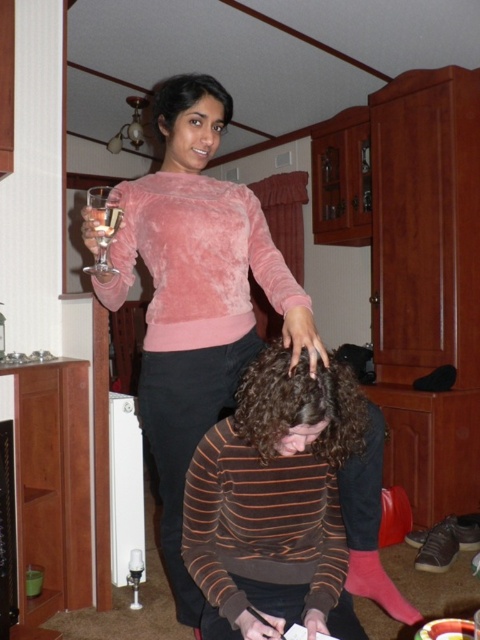
Does velvet pink sweater at upper center appear over clear glass wine glass at upper left?

No, velvet pink sweater at upper center is not above clear glass wine glass at upper left.

The width and height of the screenshot is (480, 640). What do you see at coordinates (195, 296) in the screenshot?
I see `velvet pink sweater at upper center` at bounding box center [195, 296].

Locate an element on the screen. This screenshot has height=640, width=480. velvet pink sweater at upper center is located at coordinates (195, 296).